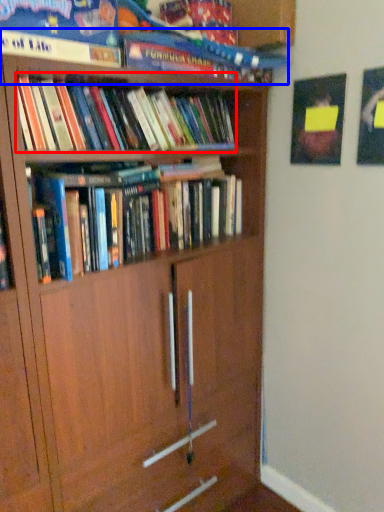
Question: Which object appears farthest to the camera in this image, book (highlighted by a red box) or book (highlighted by a blue box)?

Choices:
 (A) book
 (B) book

Answer: (A)